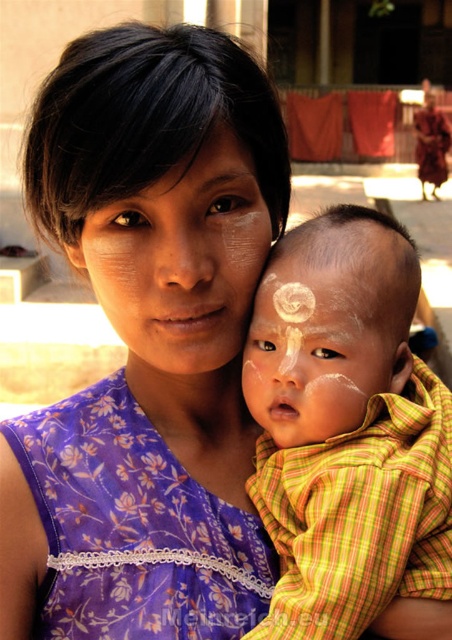
Does purple floral fabric dress at center appear under pale skin with white markings at center?

Indeed, purple floral fabric dress at center is positioned under pale skin with white markings at center.

This screenshot has height=640, width=452. Identify the location of purple floral fabric dress at center. (133, 529).

Does pale skin with white markings at center lie in front of white painted face at center?

No.

This screenshot has height=640, width=452. Identify the location of pale skin with white markings at center. (182, 259).

Is purple floral fabric dress at center taller than white painted face at center?

Yes.

Which is in front, point (17, 452) or point (338, 310)?

Positioned in front is point (338, 310).

Find the location of a particular element. This screenshot has height=640, width=452. purple floral fabric dress at center is located at coordinates (133, 529).